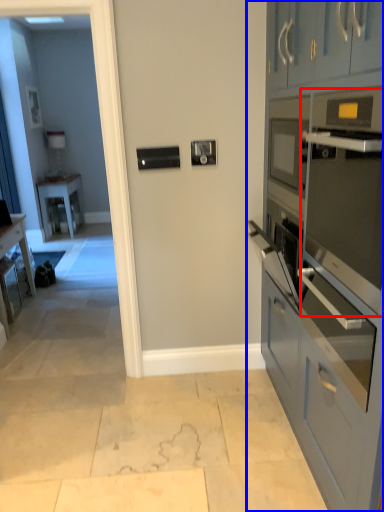
Question: Which object appears farthest to the camera in this image, oven (highlighted by a red box) or cabinetry (highlighted by a blue box)?

Choices:
 (A) oven
 (B) cabinetry

Answer: (A)